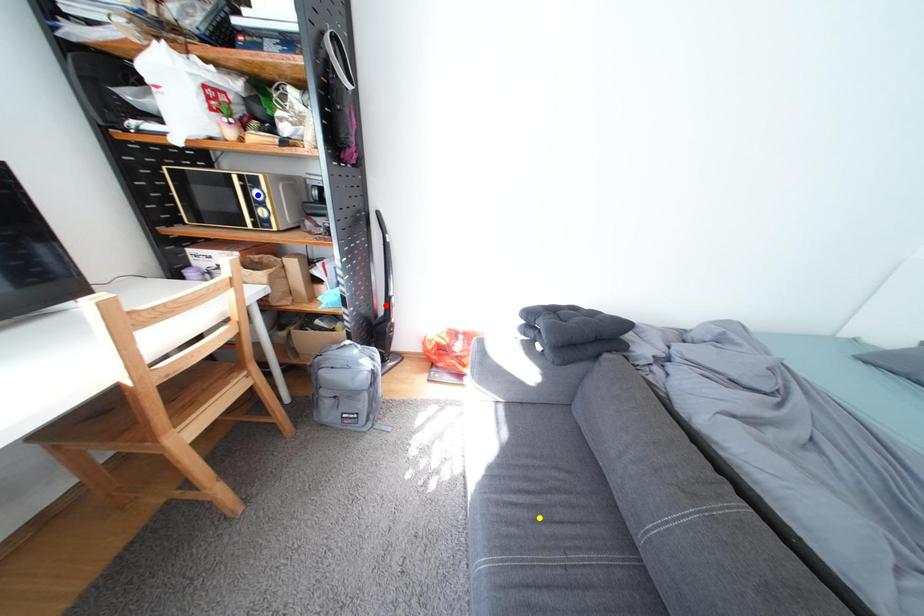
Order these from nearest to farthest:
blue point | red point | yellow point

red point < blue point < yellow point